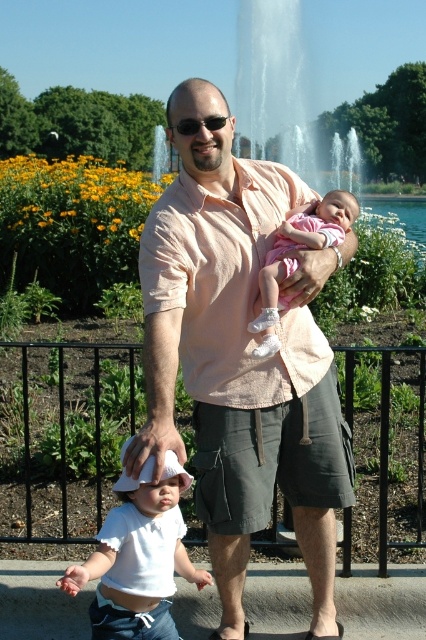
Question: Among these points, which one is farthest from the camera?

Choices:
 (A) (173, 483)
 (B) (206, 125)

Answer: (B)

Question: Is white cotton shirt at lower left below pink fabric baby at center?

Choices:
 (A) no
 (B) yes

Answer: (B)

Question: Does pink cotton shirt at center appear under white cotton shirt at lower left?

Choices:
 (A) yes
 (B) no

Answer: (B)

Question: Which of the following is the farthest from the observer?

Choices:
 (A) sunglasses at center
 (B) pink fabric baby at center
 (C) white cotton shirt at lower left
 (D) pink cotton shirt at center

Answer: (B)

Question: Can you confirm if pink fabric baby at center is positioned above sunglasses at center?

Choices:
 (A) no
 (B) yes

Answer: (A)

Question: Which point appears closest to the camera in this image?

Choices:
 (A) (227, 116)
 (B) (108, 515)
 (C) (279, 282)
 (D) (331, 372)

Answer: (A)